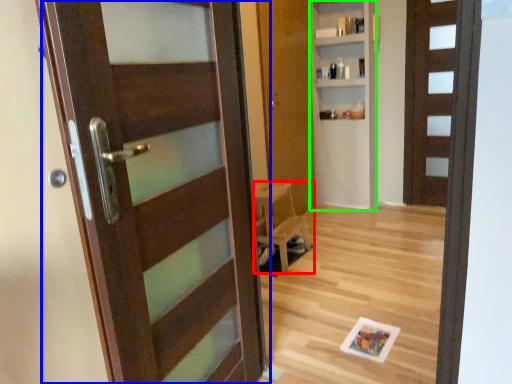
Question: Which is nearer to the furniture (highlighted by a red box)? door (highlighted by a blue box) or bookshelf (highlighted by a green box).

Choices:
 (A) door
 (B) bookshelf

Answer: (B)